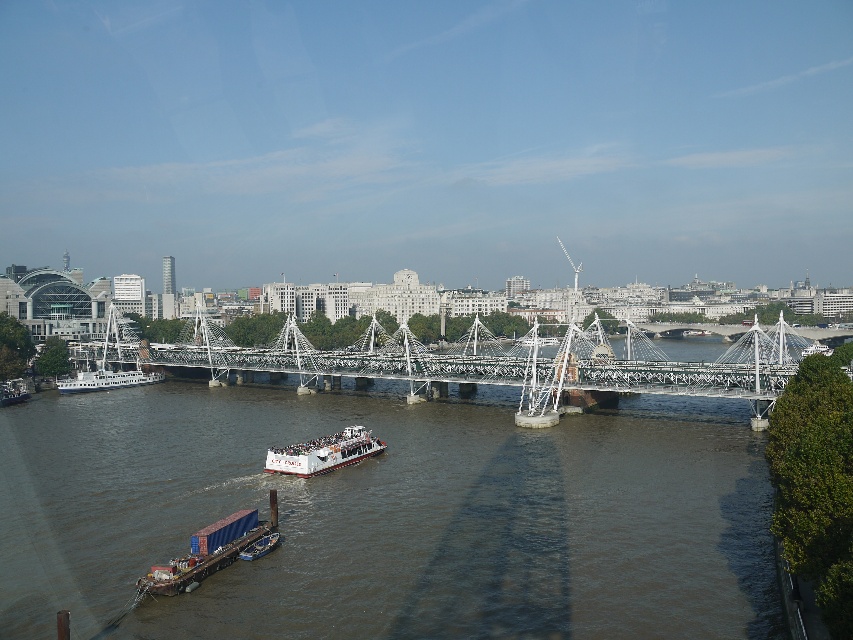
Describe the element at coordinates (541, 369) in the screenshot. This screenshot has width=853, height=640. I see `white metallic bridge at center` at that location.

Can you confirm if white metallic bridge at center is smaller than blue container ship at lower left?

No.

Locate an element on the screen. This screenshot has width=853, height=640. white metallic bridge at center is located at coordinates (541, 369).

Is white metallic bridge at center wider than white matte boat at center?

Correct, the width of white metallic bridge at center exceeds that of white matte boat at center.

Which is in front, point (254, 352) or point (364, 429)?

Point (364, 429) is in front.

Does point (683, 368) come farther from viewer compared to point (358, 444)?

That is True.

The width and height of the screenshot is (853, 640). I want to click on white metallic bridge at center, so click(x=541, y=369).

I want to click on white matte boat at center, so click(323, 452).